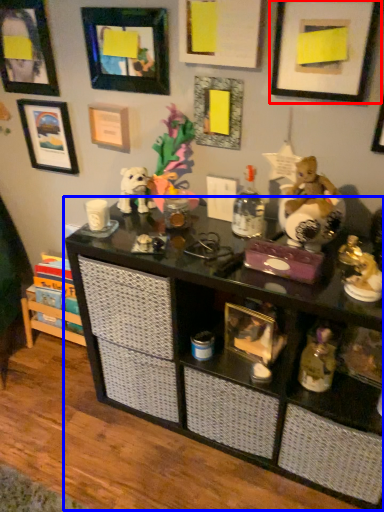
Question: Which object appears closest to the camera in this image, picture frame (highlighted by a red box) or shelf (highlighted by a blue box)?

Choices:
 (A) picture frame
 (B) shelf

Answer: (B)